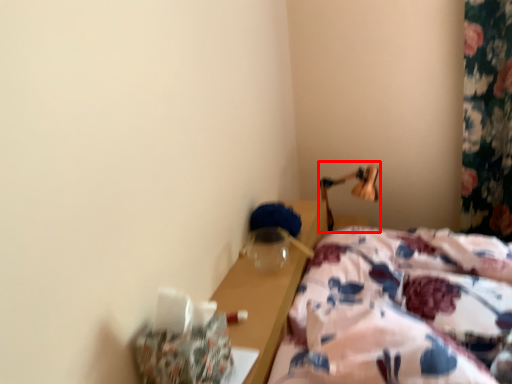
Question: From the image's perspective, where is bedside lamp (annotated by the red box) located relative to bed?

Choices:
 (A) above
 (B) below

Answer: (A)